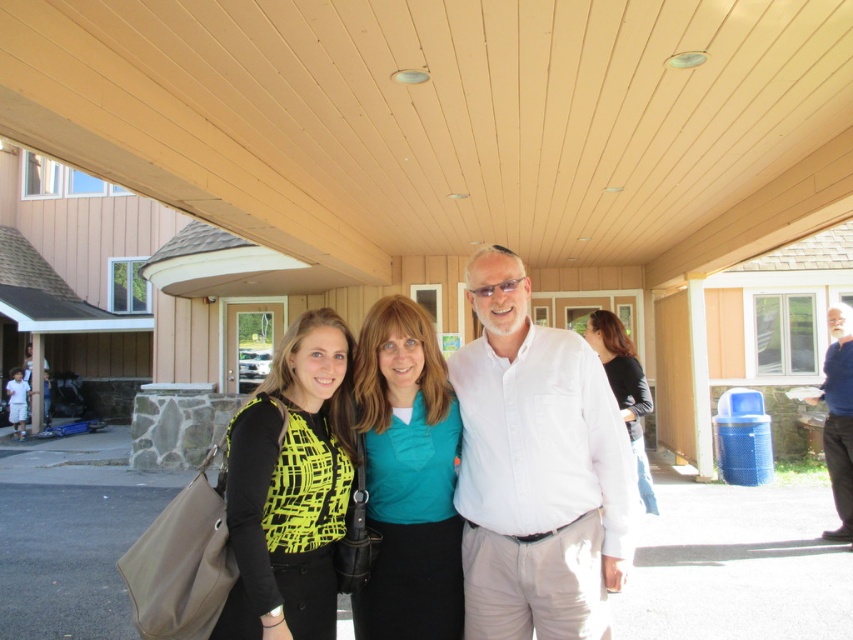
Between neon green fabric shirt at center and teal fabric shirt at center, which one is positioned lower?

Positioned lower is teal fabric shirt at center.

Which of these two, neon green fabric shirt at center or teal fabric shirt at center, stands shorter?

teal fabric shirt at center

Is point (607, 424) farther from viewer compared to point (375, 451)?

That is False.

At what (x,y) coordinates should I click in order to perform the action: click on neon green fabric shirt at center. Please return your answer as a coordinate pair (x, y). Looking at the image, I should click on pyautogui.click(x=537, y=468).

Does white cotton shirt at center have a lesser width compared to black jersey at center?

In fact, white cotton shirt at center might be wider than black jersey at center.

Image resolution: width=853 pixels, height=640 pixels. What do you see at coordinates (537, 468) in the screenshot?
I see `white cotton shirt at center` at bounding box center [537, 468].

The image size is (853, 640). What are the coordinates of `white cotton shirt at center` in the screenshot? It's located at (537, 468).

Where is `white cotton shirt at center`? white cotton shirt at center is located at coordinates (537, 468).

Between white cotton shirt at center and blue cotton shirt at right, which one has less height?

With less height is white cotton shirt at center.

You are a GUI agent. You are given a task and a screenshot of the screen. Output one action in this format:
    pyautogui.click(x=<x>, y=<y>)
    Task: Click on the white cotton shirt at center
    This screenshot has height=640, width=853.
    Given the screenshot: What is the action you would take?
    pyautogui.click(x=537, y=468)

This screenshot has width=853, height=640. I want to click on white cotton shirt at center, so click(537, 468).